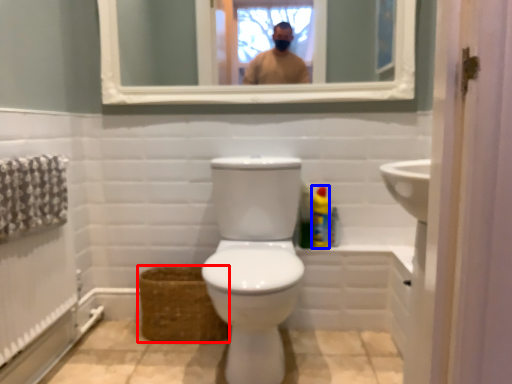
Question: Which object is further to the camera taking this photo, basket (highlighted by a red box) or cleaning product (highlighted by a blue box)?

Choices:
 (A) basket
 (B) cleaning product

Answer: (B)